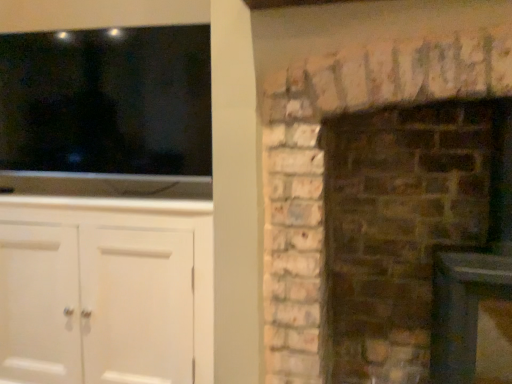
The width and height of the screenshot is (512, 384). Describe the element at coordinates (109, 288) in the screenshot. I see `white painted wood cabinet at left` at that location.

Identify the location of white painted wood cabinet at left. point(109,288).

Is black glossy tv at upper left at the back of white painted wood cabinet at left?

No, white painted wood cabinet at left's orientation is not away from black glossy tv at upper left.

Relative to black glossy tv at upper left, is white painted wood cabinet at left in front or behind?

Visually, white painted wood cabinet at left is located in front of black glossy tv at upper left.

How distant is white painted wood cabinet at left from black glossy tv at upper left?

white painted wood cabinet at left and black glossy tv at upper left are 39.05 centimeters apart.

Are white painted wood cabinet at left and black glossy tv at upper left beside each other?

white painted wood cabinet at left and black glossy tv at upper left are clearly separated.

Is black glossy tv at upper left not near white painted wood cabinet at left?

That's not correct — black glossy tv at upper left is a little close to white painted wood cabinet at left.

Does black glossy tv at upper left have a greater width compared to white painted wood cabinet at left?

No, black glossy tv at upper left is not wider than white painted wood cabinet at left.

Considering the sizes of objects black glossy tv at upper left and white painted wood cabinet at left in the image provided, who is smaller, black glossy tv at upper left or white painted wood cabinet at left?

With smaller size is black glossy tv at upper left.

Does black glossy tv at upper left have a lesser height compared to white painted wood cabinet at left?

Yes, black glossy tv at upper left is shorter than white painted wood cabinet at left.

Is the position of brown brick fireplace at right more distant than that of black glossy tv at upper left?

No.

Is brown brick fireplace at right far from black glossy tv at upper left?

No.

How distant is brown brick fireplace at right from black glossy tv at upper left?

A distance of 34.13 inches exists between brown brick fireplace at right and black glossy tv at upper left.

From the image's perspective, is brown brick fireplace at right positioned above or below black glossy tv at upper left?

From the image's perspective, brown brick fireplace at right appears below black glossy tv at upper left.

Can you tell me how much black glossy tv at upper left and brown brick fireplace at right differ in facing direction?

The angle between the facing direction of black glossy tv at upper left and the facing direction of brown brick fireplace at right is 0.127 degrees.

Between point (194, 46) and point (359, 177), which one is positioned behind?

Positioned behind is point (359, 177).

Is black glossy tv at upper left looking in the opposite direction of brown brick fireplace at right?

black glossy tv at upper left does not have its back to brown brick fireplace at right.

Between black glossy tv at upper left and brown brick fireplace at right, which one has larger size?

brown brick fireplace at right.

How different are the orientations of brown brick fireplace at right and white painted wood cabinet at left in degrees?

0.127 degrees separate the facing orientations of brown brick fireplace at right and white painted wood cabinet at left.

In the scene shown: From the image's perspective, which object appears higher, brown brick fireplace at right or white painted wood cabinet at left?

brown brick fireplace at right is shown above in the image.

Consider the image. Is brown brick fireplace at right facing towards white painted wood cabinet at left?

No, brown brick fireplace at right is not facing towards white painted wood cabinet at left.

Consider the image. Is white painted wood cabinet at left situated inside brown brick fireplace at right or outside?

white painted wood cabinet at left exists outside the volume of brown brick fireplace at right.

Is point (11, 350) farther from camera compared to point (448, 351)?

Yes.

From a real-world perspective, is white painted wood cabinet at left on top of brown brick fireplace at right?

Actually, white painted wood cabinet at left is physically below brown brick fireplace at right in the real world.

At what (x,y) coordinates should I click in order to perform the action: click on window that appears on the left of white painted wood cabinet at left. Please return your answer as a coordinate pair (x, y). The image size is (512, 384). Looking at the image, I should click on (106, 112).

Where is `window above the white painted wood cabinet at left (from a real-world perspective)`? This screenshot has width=512, height=384. window above the white painted wood cabinet at left (from a real-world perspective) is located at coordinates (106, 112).

Looking at the image, which one is located closer to white painted wood cabinet at left, brown brick fireplace at right or black glossy tv at upper left?

The object closer to white painted wood cabinet at left is black glossy tv at upper left.

When comparing their distances from brown brick fireplace at right, does black glossy tv at upper left or white painted wood cabinet at left seem closer?

Among the two, white painted wood cabinet at left is located nearer to brown brick fireplace at right.

Based on their spatial positions, is white painted wood cabinet at left or black glossy tv at upper left closer to brown brick fireplace at right?

white painted wood cabinet at left lies closer to brown brick fireplace at right than the other object.

When comparing their distances from white painted wood cabinet at left, does black glossy tv at upper left or brown brick fireplace at right seem further?

brown brick fireplace at right lies further to white painted wood cabinet at left than the other object.

Estimate the real-world distances between objects in this image. Which object is closer to black glossy tv at upper left, white painted wood cabinet at left or brown brick fireplace at right?

white painted wood cabinet at left is closer to black glossy tv at upper left.

From the image, which object appears to be nearer to black glossy tv at upper left, brown brick fireplace at right or white painted wood cabinet at left?

Based on the image, white painted wood cabinet at left appears to be nearer to black glossy tv at upper left.

This screenshot has width=512, height=384. I want to click on cabinetry between black glossy tv at upper left and brown brick fireplace at right, so click(109, 288).